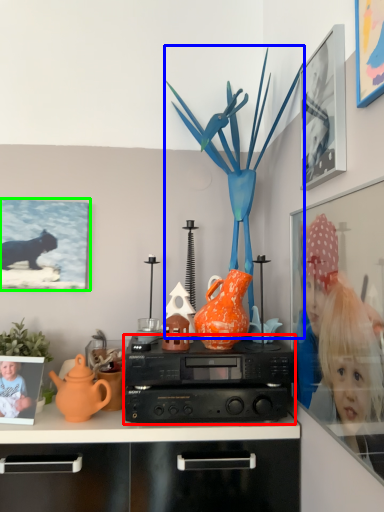
Question: Which object is the closest to the stereo (highlighted by a red box)? Choose among these: toy (highlighted by a blue box) or picture frame (highlighted by a green box).

Choices:
 (A) toy
 (B) picture frame

Answer: (A)